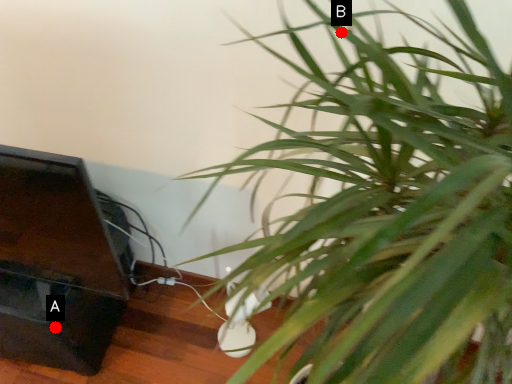
Question: Two points are circled on the image, labeled by A and B beside each circle. Among these points, which one is nearest to the camera?

Choices:
 (A) A is closer
 (B) B is closer

Answer: (B)